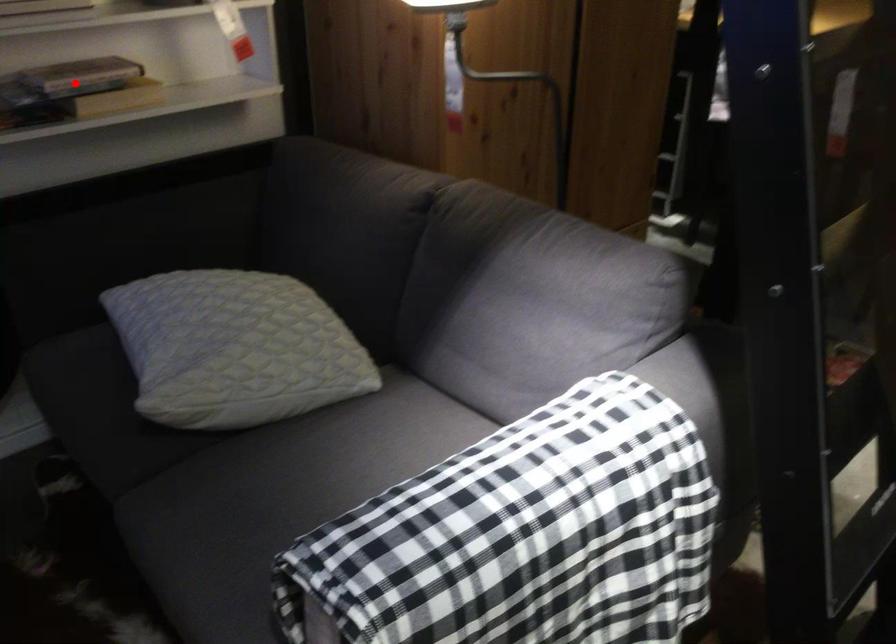
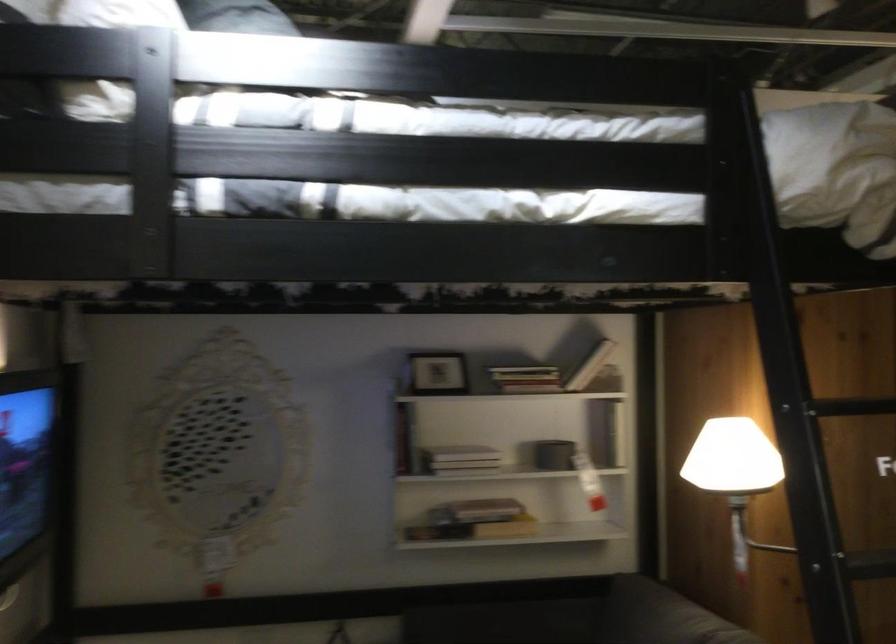
Question: I am providing you with two images of the same scene from different viewpoints. A red point is marked on the first image. Is the red point's position out of view in image 2?

Choices:
 (A) Yes
 (B) No

Answer: (B)